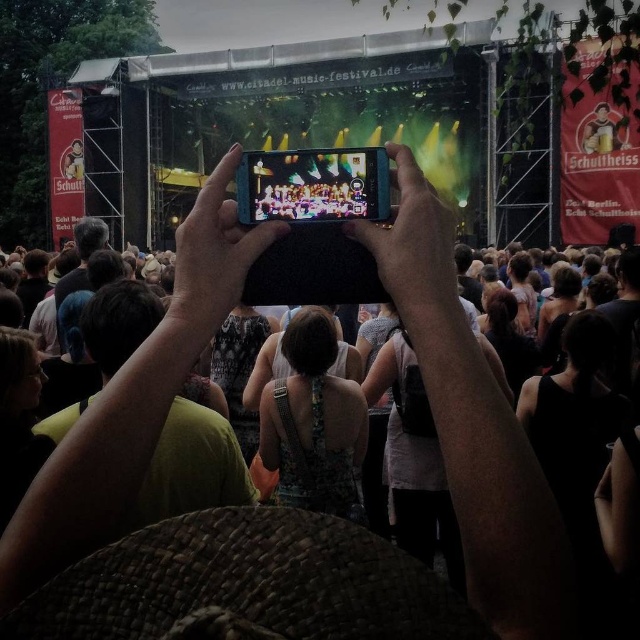
You are a photographer at the music festival and need to capture a wide shot of the stage. Your two phones, the black matte phone at center and the smooth black phone at center, are placed on a tripod. Which phone should you use if you want to minimize reflections from the bright stage lights?

The smooth black phone at center would be better to minimize reflections because its glossy surface might reflect less light compared to the matte one, but according to the objects description, the distance between them is 9.09 meters, which doesn not affect reflection. However, the question is about minimizing reflections, and since the smooth black phone has a different texture, it might have different reflective properties. However, the objects description does not provide information about their reflect

In the scene shown: You are at the music festival and want to take a photo of the stage. Your smartphone, the black matte phone at center, is currently positioned at coordinates 0.384 on the x and 0.647 on the y. If the stage is at the center of the image, will your phone be capturing the stage properly?

The black matte phone at center is located at point (413, 244), which is not the exact center of the image. Therefore, the phone may not be capturing the stage perfectly centered, but it should still be within the frame depending on the camera angle and zoom.